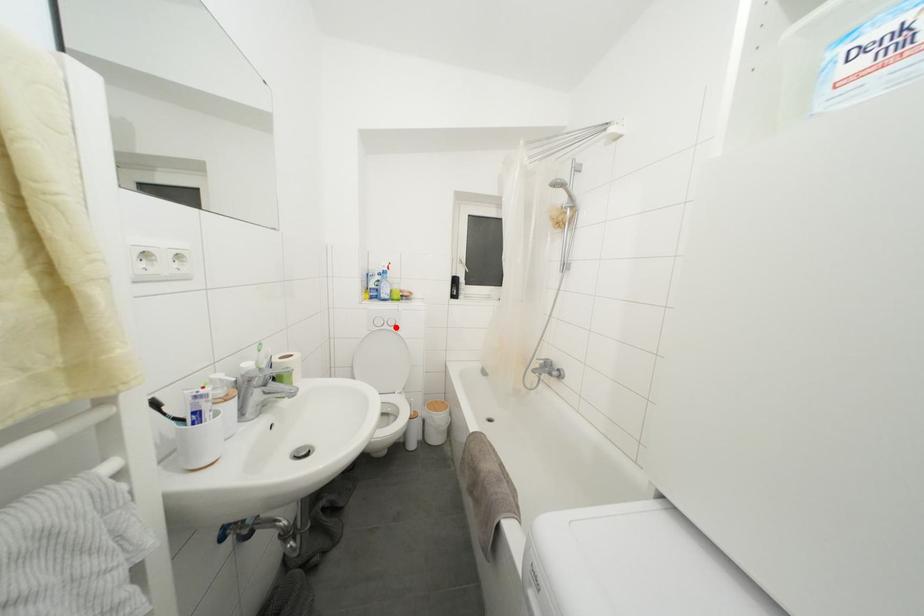
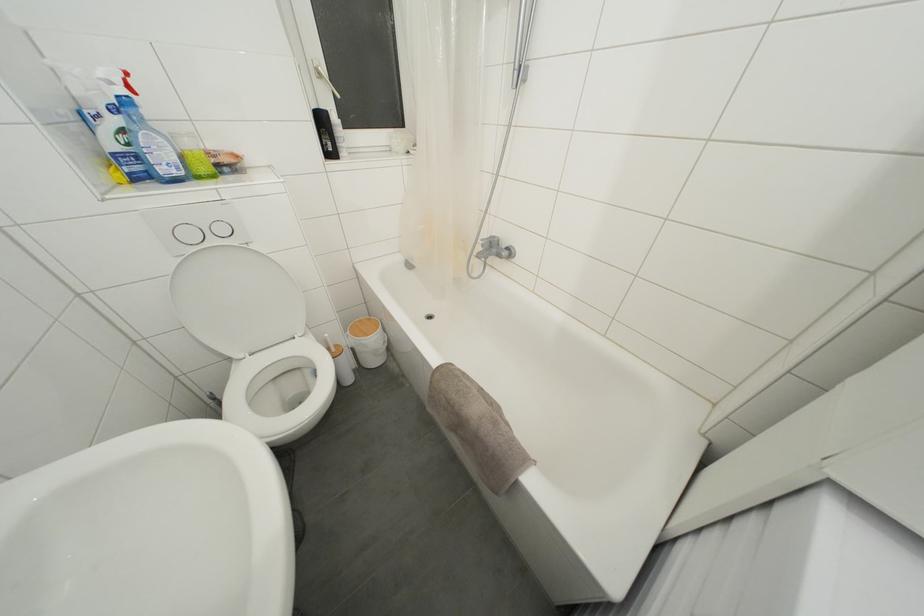
In the second image, find the point that corresponds to the highlighted location in the first image.

(226, 235)